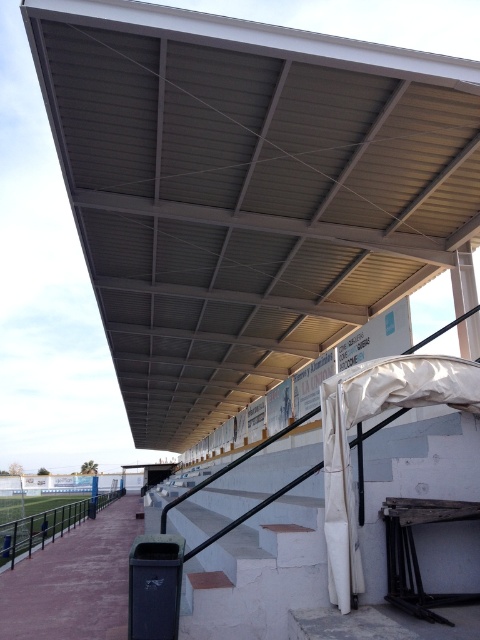
You are standing at the origin point of the coordinate system. You want to locate the metallic gray roof at upper center. In which direction should you look relative to your current position?

You should look towards the point at coordinates 0.300 in the x direction and 0.515 in the y direction to locate the metallic gray roof at upper center.

You are attending a soccer match in this stadium and want to know if the metallic gray roof at upper center provides shade over the brushed metal rail at lower left. Based on the scene description, can you determine if the roof is positioned to cover the rail?

The metallic gray roof at upper center is above the brushed metal rail at lower left, so yes, the roof is positioned to provide shade over the rail.